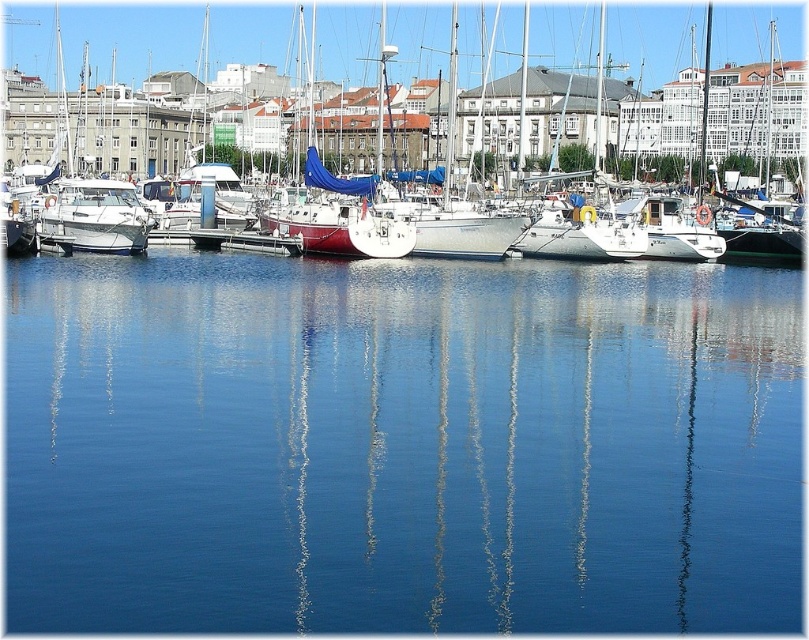
Is blue smooth water at center above white glossy boat at left?

Incorrect, blue smooth water at center is not positioned above white glossy boat at left.

Who is more distant from viewer, (337, 454) or (104, 208)?

The point (104, 208) is more distant.

At what (x,y) coordinates should I click in order to perform the action: click on blue smooth water at center. Please return your answer as a coordinate pair (x, y). The height and width of the screenshot is (640, 809). Looking at the image, I should click on (401, 445).

The width and height of the screenshot is (809, 640). Identify the location of blue smooth water at center. (401, 445).

Where is `blue smooth water at center`? The height and width of the screenshot is (640, 809). blue smooth water at center is located at coordinates (401, 445).

Who is more forward, [108,460] or [184,33]?

Point [108,460]

Identify the location of blue smooth water at center. The width and height of the screenshot is (809, 640). (401, 445).

Is blue smooth water at center to the right of white wood dock at center from the viewer's perspective?

Correct, you'll find blue smooth water at center to the right of white wood dock at center.

Between blue smooth water at center and white wood dock at center, which one has more height?

blue smooth water at center is taller.

The image size is (809, 640). Find the location of `blue smooth water at center`. blue smooth water at center is located at coordinates (401, 445).